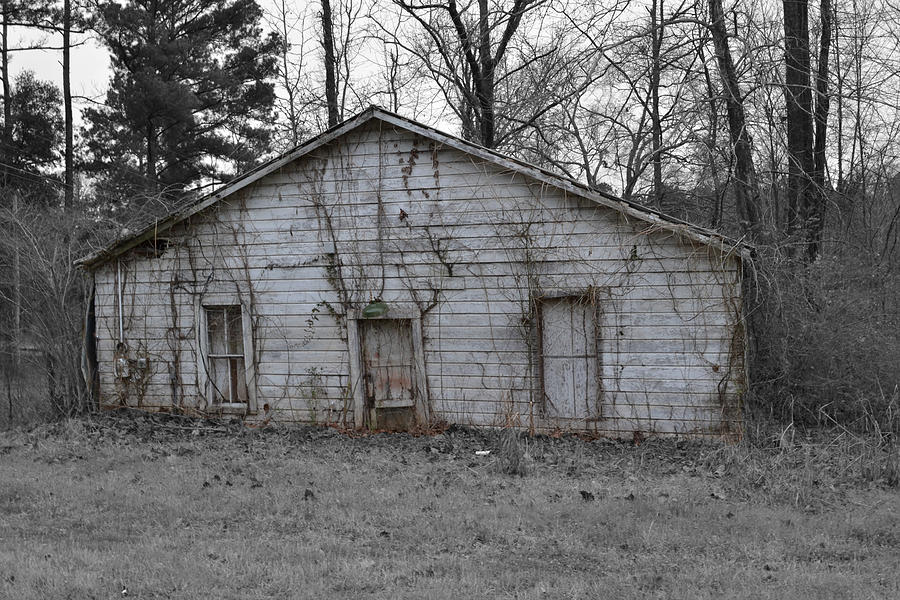
Where is `window`? window is located at coordinates (220, 337), (221, 387).